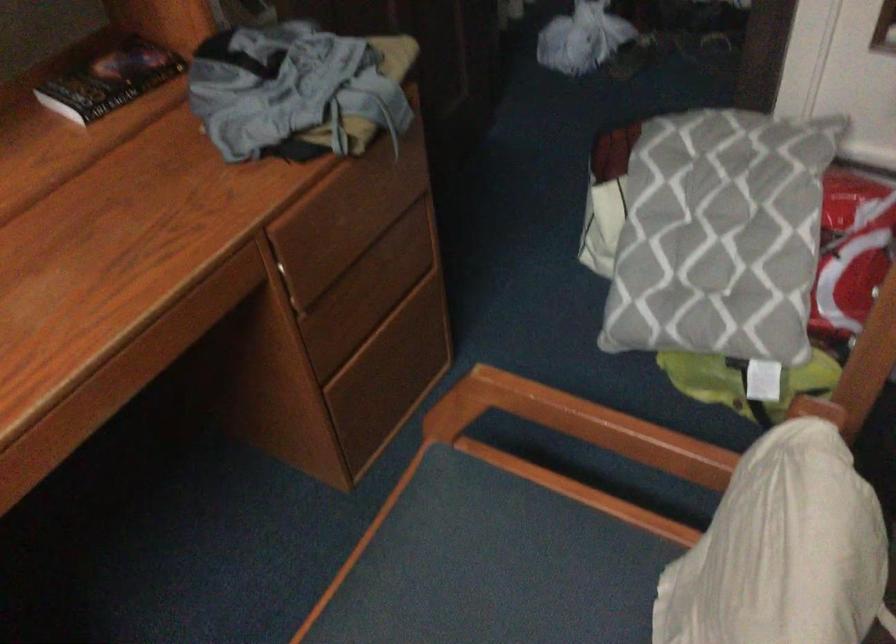
Locate an element on the screen. This screenshot has height=644, width=896. chair sitting surface is located at coordinates (549, 580).